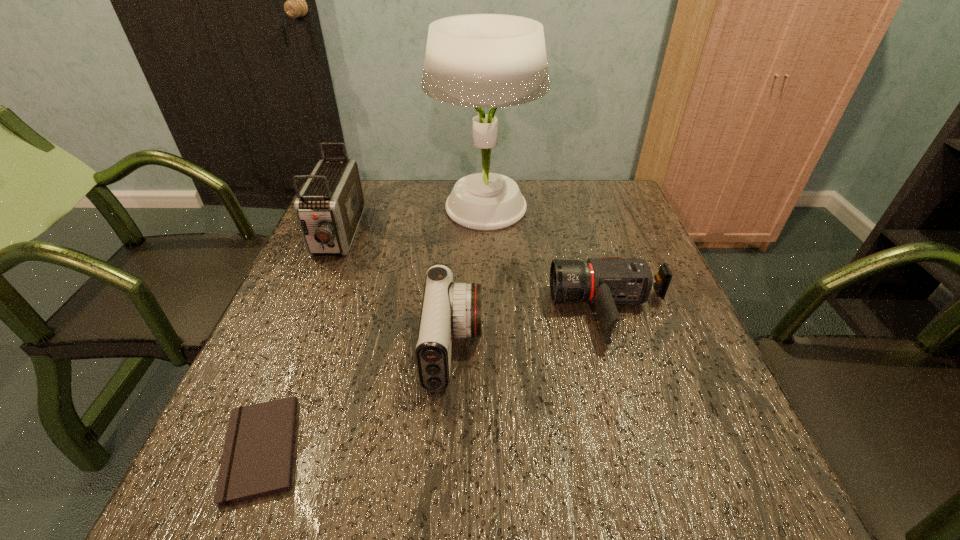
Identify the location of free spot located 0.300m on the front-facing side of the tallest object. The width and height of the screenshot is (960, 540). (329, 207).

Where is `vacant space positioned 0.290m on the front-facing side of the tallest object`? This screenshot has width=960, height=540. vacant space positioned 0.290m on the front-facing side of the tallest object is located at coordinates (333, 207).

Where is `vacant area situated at the lens of the farthest camcorder`? The image size is (960, 540). vacant area situated at the lens of the farthest camcorder is located at coordinates (302, 318).

Find the location of a particular element. Image resolution: width=960 pixels, height=540 pixels. vacant space located on the surface of the third shortest object is located at coordinates (511, 348).

Image resolution: width=960 pixels, height=540 pixels. What are the coordinates of `vacant region located on the lens of the fourth tallest object` in the screenshot? It's located at (485, 310).

Identify the location of free space located on the lens of the fourth tallest object. This screenshot has height=540, width=960. 503,310.

The height and width of the screenshot is (540, 960). Find the location of `vacant area located on the lens of the fourth tallest object`. vacant area located on the lens of the fourth tallest object is located at coordinates (431, 310).

Find the location of a particular element. free space located on the right of the nearest object is located at coordinates (365, 449).

Where is `lamp that is at the far edge`? Image resolution: width=960 pixels, height=540 pixels. lamp that is at the far edge is located at coordinates (476, 60).

This screenshot has height=540, width=960. I want to click on camcorder that is at the far edge, so click(329, 207).